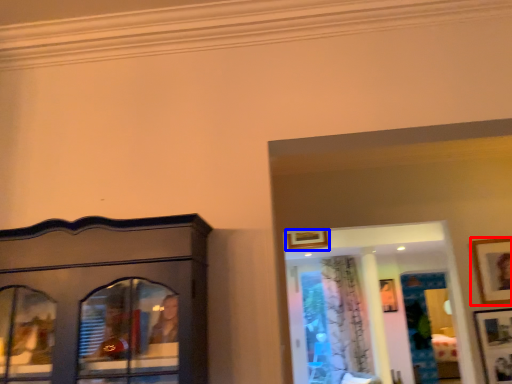
Question: Which object is further to the camera taking this photo, picture frame (highlighted by a red box) or picture frame (highlighted by a blue box)?

Choices:
 (A) picture frame
 (B) picture frame

Answer: (B)